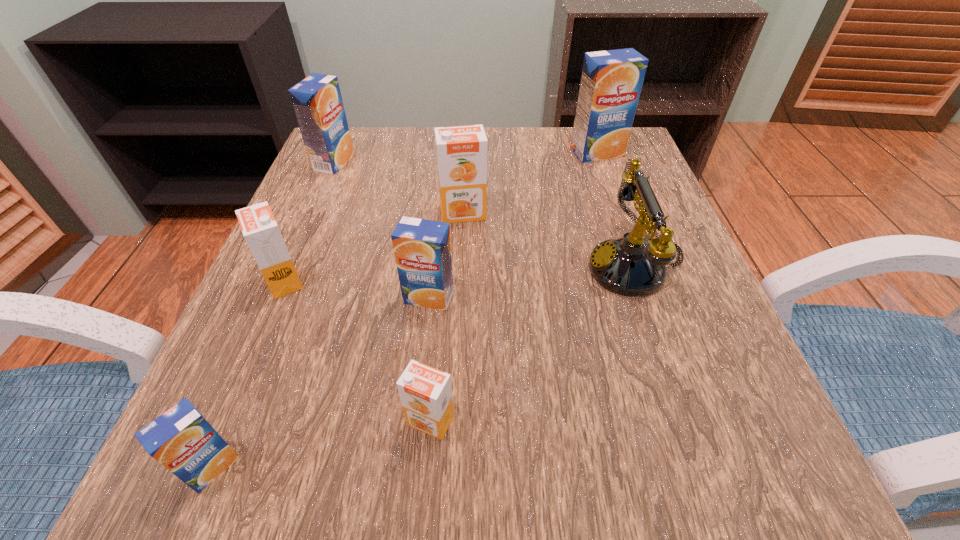
This screenshot has height=540, width=960. I want to click on the tallest orange_juice, so click(611, 81).

Find the location of a particular element. This screenshot has height=540, width=960. the rightmost orange_juice is located at coordinates (611, 81).

The width and height of the screenshot is (960, 540). Identify the location of the second biggest blue orange_juice. (317, 101).

Where is `the biggest orange orange juice`? Image resolution: width=960 pixels, height=540 pixels. the biggest orange orange juice is located at coordinates (461, 151).

Locate an element on the screen. the third farthest object is located at coordinates (461, 151).

Locate an element on the screen. This screenshot has width=960, height=540. telephone is located at coordinates (629, 266).

At what (x,y) coordinates should I click in order to perform the action: click on the third biggest blue orange_juice. Please return your answer as a coordinate pair (x, y). This screenshot has width=960, height=540. Looking at the image, I should click on (422, 249).

At what (x,y) coordinates should I click in order to perform the action: click on the third farthest blue orange_juice. Please return your answer as a coordinate pair (x, y). Looking at the image, I should click on (422, 249).

You are a GUI agent. You are given a task and a screenshot of the screen. Output one action in this format:
    pyautogui.click(x=<x>, y=<y>)
    Task: Click on the second nearest orange orange juice
    This screenshot has height=540, width=960.
    Given the screenshot: What is the action you would take?
    tap(260, 230)

The height and width of the screenshot is (540, 960). What are the coordinates of `the leftmost orange orange juice` in the screenshot? It's located at (260, 230).